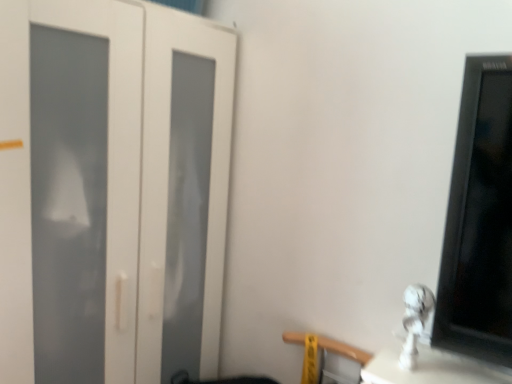
Question: Is white glossy statue at lower right behind wooden at lower right?

Choices:
 (A) no
 (B) yes

Answer: (A)

Question: From the image's perspective, does white glossy statue at lower right appear lower than wooden at lower right?

Choices:
 (A) yes
 (B) no

Answer: (B)

Question: Is white glossy statue at lower right looking in the opposite direction of wooden at lower right?

Choices:
 (A) yes
 (B) no

Answer: (B)

Question: Is white glossy statue at lower right closer to the viewer compared to wooden at lower right?

Choices:
 (A) no
 (B) yes

Answer: (B)

Question: From a real-world perspective, is white glossy statue at lower right physically above wooden at lower right?

Choices:
 (A) yes
 (B) no

Answer: (A)

Question: From the image's perspective, is white matte door at left above or below white glossy statue at lower right?

Choices:
 (A) below
 (B) above

Answer: (B)

Question: In terms of height, does white matte door at left look taller or shorter compared to white glossy statue at lower right?

Choices:
 (A) short
 (B) tall

Answer: (B)

Question: Is white matte door at left in front of or behind white glossy statue at lower right in the image?

Choices:
 (A) front
 (B) behind

Answer: (B)

Question: In the image, is white matte door at left on the left side or the right side of white glossy statue at lower right?

Choices:
 (A) left
 (B) right

Answer: (A)

Question: From their relative heights in the image, would you say white matte door at left is taller or shorter than wooden at lower right?

Choices:
 (A) tall
 (B) short

Answer: (A)

Question: From the image's perspective, relative to wooden at lower right, is white matte door at left above or below?

Choices:
 (A) below
 (B) above

Answer: (B)

Question: In terms of width, does white matte door at left look wider or thinner when compared to wooden at lower right?

Choices:
 (A) wide
 (B) thin

Answer: (A)

Question: Relative to wooden at lower right, is white matte door at left in front or behind?

Choices:
 (A) front
 (B) behind

Answer: (A)

Question: In terms of width, does white glossy statue at lower right look wider or thinner when compared to white matte door at left?

Choices:
 (A) thin
 (B) wide

Answer: (A)

Question: From a real-world perspective, is white glossy statue at lower right physically located above or below white matte door at left?

Choices:
 (A) above
 (B) below

Answer: (A)